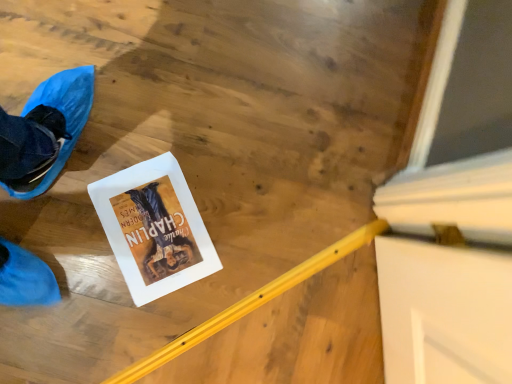
The height and width of the screenshot is (384, 512). I want to click on empty space that is to the right of white paper book cover at center, so click(237, 288).